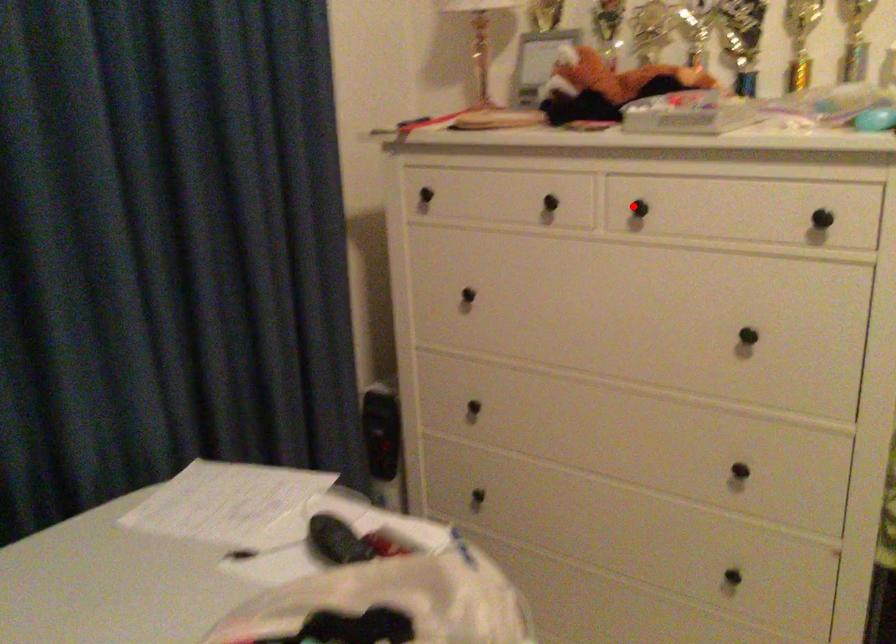
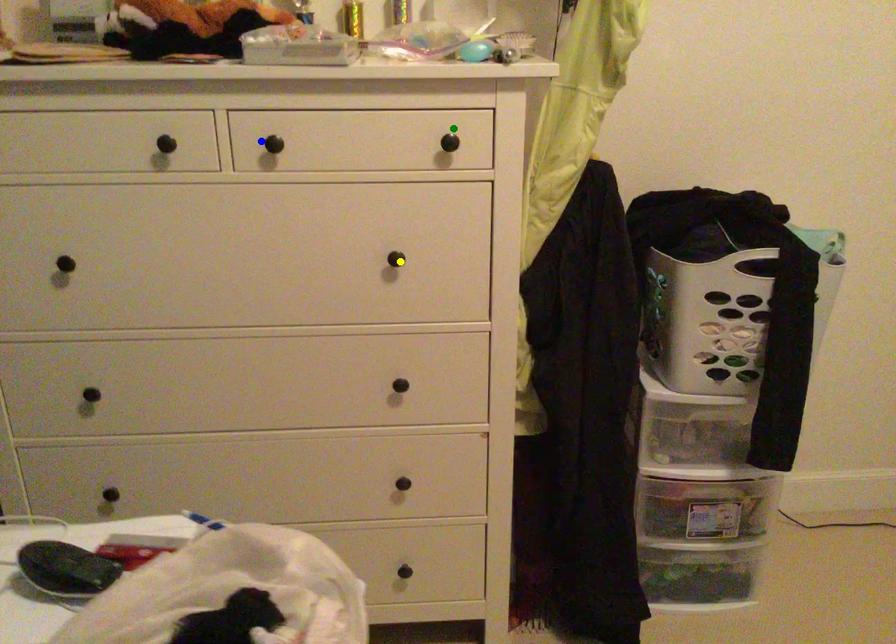
Question: I am providing you with two images of the same scene from different viewpoints. A red point is marked on the first image. You are given multiple points on the second image. Which spot in image 2 lines up with the point in image 1?

Choices:
 (A) yellow point
 (B) blue point
 (C) green point

Answer: (B)